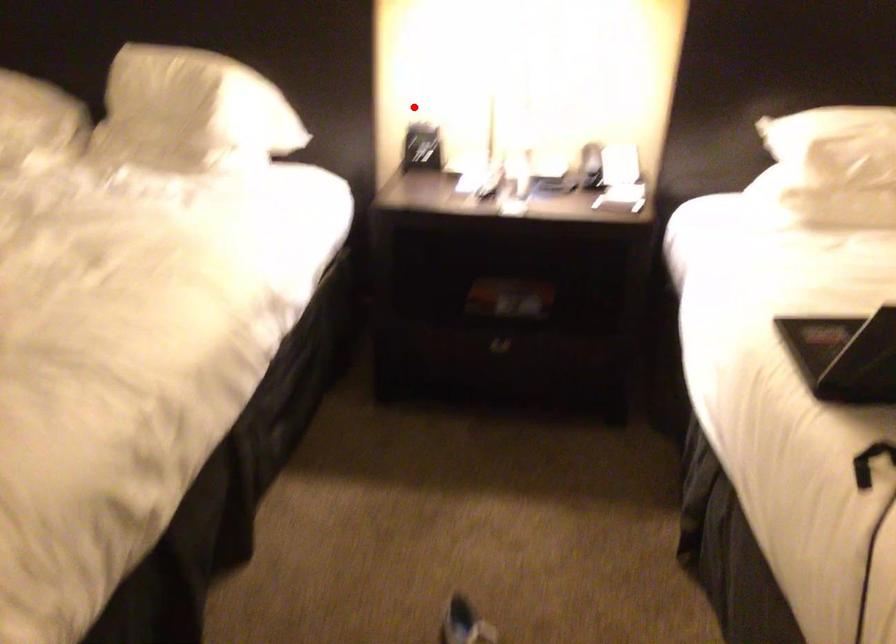
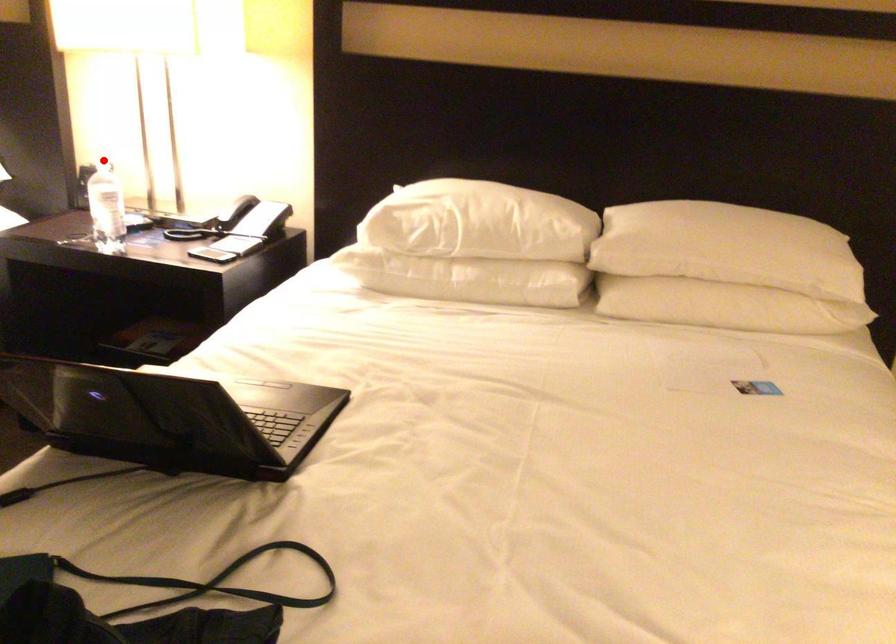
I am providing you with two images of the same scene from different viewpoints. A red point is marked on the first image and another point is marked on the second image. Are the points marked in image1 and image2 representing the same 3D position?

Yes